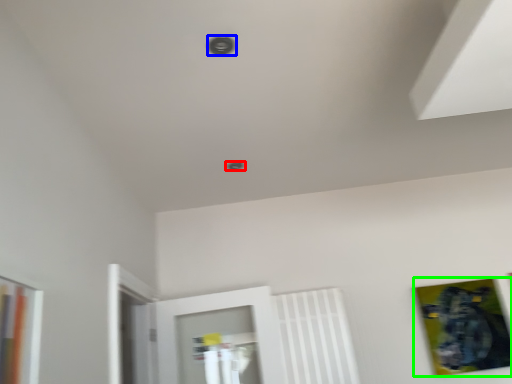
Question: Based on their relative distances, which object is nearer to hole (highlighted by a red box)? Choose from hole (highlighted by a blue box) and picture frame (highlighted by a green box).

Choices:
 (A) hole
 (B) picture frame

Answer: (A)